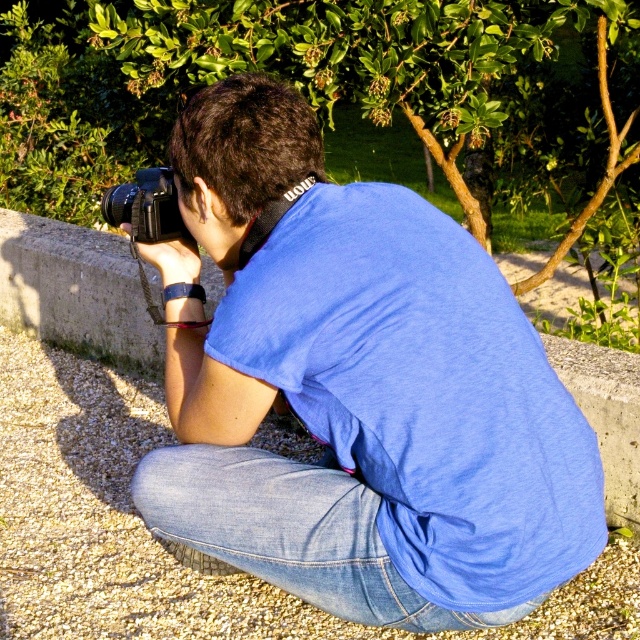
Question: Is blue cotton shirt at center behind black plastic camera at center?

Choices:
 (A) yes
 (B) no

Answer: (B)

Question: Which point is farther to the camera?

Choices:
 (A) blue cotton shirt at center
 (B) black plastic camera at center
 (C) denim at lower center

Answer: (B)

Question: Which point is closer to the camera taking this photo?

Choices:
 (A) (269, 440)
 (B) (256, 568)
 (C) (166, 188)
 (D) (285, 148)

Answer: (D)

Question: Does gray gravel at lower left have a greater width compared to denim at lower center?

Choices:
 (A) no
 (B) yes

Answer: (B)

Question: Which point is farther from the camera taking this photo?

Choices:
 (A) (504, 371)
 (B) (144, 179)
 (C) (92, 547)

Answer: (C)

Question: Does gray gravel at lower left have a larger size compared to denim at lower center?

Choices:
 (A) yes
 (B) no

Answer: (A)